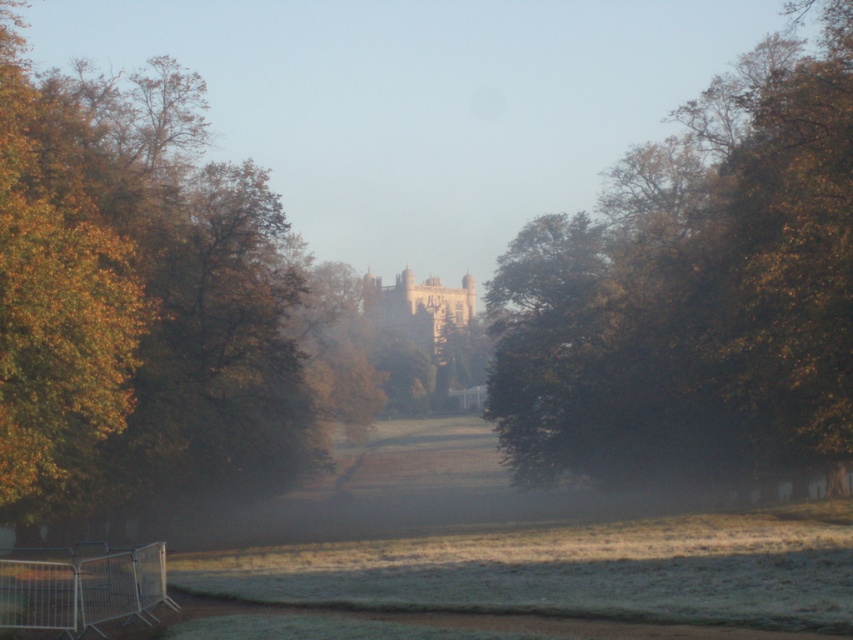
Question: Does golden leafy tree at center appear under green leafy tree at center?

Choices:
 (A) no
 (B) yes

Answer: (B)

Question: Considering the relative positions of golden leafy tree at center and green leafy tree at center in the image provided, where is golden leafy tree at center located with respect to green leafy tree at center?

Choices:
 (A) above
 (B) below

Answer: (B)

Question: Does golden leafy tree at center have a smaller size compared to green leafy tree at center?

Choices:
 (A) no
 (B) yes

Answer: (A)